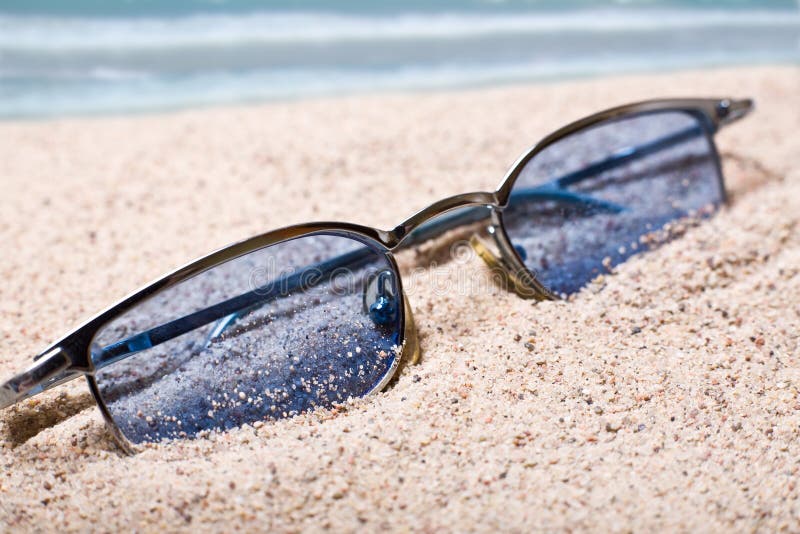
The height and width of the screenshot is (534, 800). I want to click on pad arms, so click(x=382, y=282), click(x=521, y=248).